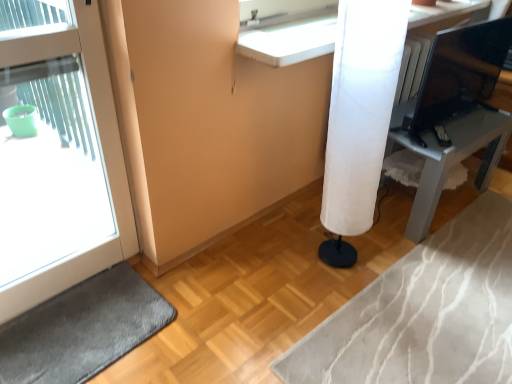
What do you see at coordinates (459, 73) in the screenshot?
I see `matte black monitor at upper right` at bounding box center [459, 73].

In order to face matte black monitor at upper right, should I rotate leftwards or rightwards?

You should look right and rotate roughly 27.105 degrees.

Find the location of `white fabric lampshade at center-right`. white fabric lampshade at center-right is located at coordinates pyautogui.click(x=360, y=109).

Describe the element at coordinates (290, 39) in the screenshot. The height and width of the screenshot is (384, 512). I see `white glossy counter at upper center` at that location.

This screenshot has height=384, width=512. What do you see at coordinates (82, 329) in the screenshot? I see `dark gray carpet at lower left` at bounding box center [82, 329].

This screenshot has height=384, width=512. Find the location of `matte black monitor at upper right`. matte black monitor at upper right is located at coordinates coord(459,73).

Is matte black monitor at upper right facing away from white glossy door at left?

matte black monitor at upper right is not turned away from white glossy door at left.

From the image's perspective, which one is positioned higher, matte black monitor at upper right or white glossy door at left?

matte black monitor at upper right is shown above in the image.

Based on the photo, looking at the image, does matte black monitor at upper right seem bigger or smaller compared to white glossy door at left?

matte black monitor at upper right is smaller than white glossy door at left.

Considering the relative sizes of matte black monitor at upper right and white glossy door at left in the image provided, is matte black monitor at upper right taller than white glossy door at left?

Incorrect, the height of matte black monitor at upper right is not larger of that of white glossy door at left.

Between white glossy counter at upper center and white glossy door at left, which one appears on the left side from the viewer's perspective?

Positioned to the left is white glossy door at left.

Which of these two, white glossy counter at upper center or white glossy door at left, is thinner?

With smaller width is white glossy door at left.

Is white glossy counter at upper center looking in the opposite direction of white glossy door at left?

white glossy counter at upper center is not turned away from white glossy door at left.

Consider the image. From the image's perspective, is white glossy counter at upper center under white glossy door at left?

No, from the image's perspective, white glossy counter at upper center is not beneath white glossy door at left.

Is matte black monitor at upper right bigger than white glossy counter at upper center?

No.

The width and height of the screenshot is (512, 384). In order to click on counter located in front of the matte black monitor at upper right in this screenshot , I will do `click(290, 39)`.

Considering the positions of point (428, 59) and point (303, 22), is point (428, 59) closer or farther from the camera than point (303, 22)?

Point (428, 59) is positioned farther from the camera compared to point (303, 22).

In the scene shown: Does matte black monitor at upper right contain white glossy counter at upper center?

No, white glossy counter at upper center is not inside matte black monitor at upper right.

Can you confirm if white glossy door at left is shorter than white fabric lamp at right?

No.

Is white glossy door at left to the right of white fabric lamp at right from the viewer's perspective?

Incorrect, white glossy door at left is not on the right side of white fabric lamp at right.

From the image's perspective, is white glossy door at left under white fabric lamp at right?

Yes.

Looking at this image, could you tell me if white fabric lampshade at center-right is facing matte black monitor at upper right?

No.

Locate an element on the screen. This screenshot has height=384, width=512. computer monitor behind the white fabric lampshade at center-right is located at coordinates (459, 73).

Considering the relative sizes of white fabric lampshade at center-right and matte black monitor at upper right in the image provided, is white fabric lampshade at center-right bigger than matte black monitor at upper right?

Indeed, white fabric lampshade at center-right has a larger size compared to matte black monitor at upper right.

From the image's perspective, between white fabric lampshade at center-right and matte black monitor at upper right, who is located below?

white fabric lampshade at center-right.

Find the location of a particular element. The height and width of the screenshot is (384, 512). counter above the white fabric lamp at right (from the image's perspective) is located at coordinates (290, 39).

From the picture: From a real-world perspective, is white glossy counter at upper center below white fabric lamp at right?

Actually, white glossy counter at upper center is physically above white fabric lamp at right in the real world.

Which object is thinner, white glossy counter at upper center or white fabric lamp at right?

white glossy counter at upper center.

Could matte black monitor at upper right be considered to be inside white glossy door at left?

No, matte black monitor at upper right is not surrounded by white glossy door at left.

Considering the sizes of white glossy door at left and matte black monitor at upper right in the image, is white glossy door at left wider or thinner than matte black monitor at upper right?

Considering their sizes, white glossy door at left looks slimmer than matte black monitor at upper right.

Would you say white glossy door at left is to the left or to the right of matte black monitor at upper right in the picture?

white glossy door at left is to the left of matte black monitor at upper right.

Find the location of a particular element. This screenshot has width=512, height=384. computer monitor to the right of white glossy door at left is located at coordinates (459, 73).

I want to click on computer monitor that is above the white glossy door at left (from the image's perspective), so click(x=459, y=73).

The height and width of the screenshot is (384, 512). In order to click on counter on the right of white glossy door at left in this screenshot , I will do `click(290, 39)`.

Which object lies further to the anchor point white glossy counter at upper center, white fabric lamp at right or dark gray carpet at lower left?

dark gray carpet at lower left is further to white glossy counter at upper center.

From the picture: When comparing their distances from white glossy counter at upper center, does matte black monitor at upper right or white glossy door at left seem further?

Based on the image, matte black monitor at upper right appears to be further to white glossy counter at upper center.

Looking at the image, which one is located further to matte black monitor at upper right, white glossy counter at upper center or dark gray carpet at lower left?

dark gray carpet at lower left.

From the picture: Which object lies nearer to the anchor point white glossy door at left, white fabric lamp at right or white fabric lampshade at center-right?

white fabric lampshade at center-right is closer to white glossy door at left.

When comparing their distances from white fabric lamp at right, does white glossy counter at upper center or dark gray carpet at lower left seem further?

The object further to white fabric lamp at right is dark gray carpet at lower left.

Considering their positions, is matte black monitor at upper right positioned further to white fabric lampshade at center-right than white fabric lamp at right?

matte black monitor at upper right is positioned further to the anchor white fabric lampshade at center-right.

In the scene shown: Which object lies further to the anchor point white fabric lamp at right, matte black monitor at upper right or white glossy door at left?

Based on the image, white glossy door at left appears to be further to white fabric lamp at right.

From the image, which object appears to be nearer to white fabric lampshade at center-right, white glossy door at left or white glossy counter at upper center?

white glossy counter at upper center.

I want to click on shower curtain between dark gray carpet at lower left and matte black monitor at upper right in the horizontal direction, so click(x=360, y=109).

You are a GUI agent. You are given a task and a screenshot of the screen. Output one action in this format:
    pyautogui.click(x=<x>, y=<y>)
    Task: Click on the furniture between white glossy counter at upper center and white fabric lampshade at center-right from top to bottom
    
    Given the screenshot: What is the action you would take?
    pyautogui.click(x=451, y=159)

Identify the location of shower curtain between white glossy counter at upper center and dark gray carpet at lower left in the up-down direction. The height and width of the screenshot is (384, 512). (360, 109).

Where is `computer monitor that lies between white glossy counter at upper center and white fabric lamp at right from top to bottom`? The height and width of the screenshot is (384, 512). computer monitor that lies between white glossy counter at upper center and white fabric lamp at right from top to bottom is located at coordinates (459, 73).